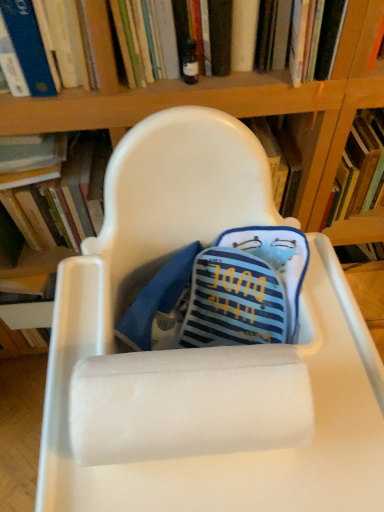
Measure the distance between hardcover book at upper center, the 3th book in the left-to-right sequence, and camera.

The distance of hardcover book at upper center, the 3th book in the left-to-right sequence, from camera is 23.37 inches.

Measure the distance between white fluffy paper towel at center and camera.

They are 15.78 inches apart.

What do you see at coordinates (203, 353) in the screenshot? The height and width of the screenshot is (512, 384). I see `white plastic chair at center` at bounding box center [203, 353].

In order to face hardcover book at left, the first book from the left, should I rotate leftwards or rightwards?

Turn left approximately 18.351 degrees to face it.

What do you see at coordinates (63, 199) in the screenshot?
I see `hardcover book at left, the first book from the left` at bounding box center [63, 199].

This screenshot has width=384, height=512. What are the coordinates of `hardcover book at upper center, the 1th book viewed from the right` in the screenshot? It's located at (245, 80).

Considering the sizes of hardcover book at upper center, the 1th book viewed from the right, and white plastic chair at center in the image, is hardcover book at upper center, the 1th book viewed from the right, bigger or smaller than white plastic chair at center?

hardcover book at upper center, the 1th book viewed from the right, is smaller than white plastic chair at center.

Is hardcover book at upper center, the 3th book in the left-to-right sequence, positioned before white plastic chair at center?

No, hardcover book at upper center, the 3th book in the left-to-right sequence, is behind white plastic chair at center.

Can white plastic chair at center be found inside hardcover book at upper center, the 1th book viewed from the right?

No, white plastic chair at center is not surrounded by hardcover book at upper center, the 1th book viewed from the right.

From a real-world perspective, starting from the blue hardcover book at upper left, arranged as the 2th book when viewed from the left, which book is the 2nd one below it? Please provide its 2D coordinates.

[(63, 199)]

Between hardcover book at left, which is the third book from right to left, and blue hardcover book at upper left, the 2th book viewed from the right, which one has larger size?

hardcover book at left, which is the third book from right to left.

Is white fluffy paper towel at center aimed at hardcover book at upper center, the 3th book in the left-to-right sequence?

No.

From the image's perspective, which is above, white fluffy paper towel at center or hardcover book at upper center, the 1th book viewed from the right?

hardcover book at upper center, the 1th book viewed from the right.

Where is `the 1st book directly above the white fluffy paper towel at center (from a real-world perspective)`? The width and height of the screenshot is (384, 512). the 1st book directly above the white fluffy paper towel at center (from a real-world perspective) is located at coordinates (245, 80).

Considering the positions of objects white plastic chair at center and hardcover book at left, the first book from the left, in the image provided, who is more to the right, white plastic chair at center or hardcover book at left, the first book from the left,?

From the viewer's perspective, white plastic chair at center appears more on the right side.

Is white plastic chair at center aimed at hardcover book at left, which is the third book from right to left?

No, white plastic chair at center does not turn towards hardcover book at left, which is the third book from right to left.

From a real-world perspective, which book is the 1st one above the white plastic chair at center? Please provide its 2D coordinates.

[(63, 199)]

Consider the image. Measure the distance between white fluffy paper towel at center and white plastic chair at center.

The distance of white fluffy paper towel at center from white plastic chair at center is 4.88 inches.

Considering the relative positions of white fluffy paper towel at center and white plastic chair at center in the image provided, is white fluffy paper towel at center to the left or to the right of white plastic chair at center?

In the image, white fluffy paper towel at center appears on the left side of white plastic chair at center.

Does white fluffy paper towel at center have a smaller size compared to white plastic chair at center?

Yes, white fluffy paper towel at center is smaller than white plastic chair at center.

Can white plastic chair at center be found inside white fluffy paper towel at center?

No, white plastic chair at center is not surrounded by white fluffy paper towel at center.

From the image's perspective, is hardcover book at left, which is the third book from right to left, beneath white plastic chair at center?

Actually, hardcover book at left, which is the third book from right to left, appears above white plastic chair at center in the image.

Considering the sizes of objects hardcover book at left, the first book from the left, and white plastic chair at center in the image provided, who is wider, hardcover book at left, the first book from the left, or white plastic chair at center?

white plastic chair at center is wider.

Consider the image. Is hardcover book at left, which is the third book from right to left, situated inside white plastic chair at center or outside?

The correct answer is: outside.

Considering their positions, is hardcover book at left, the first book from the left, located in front of or behind white plastic chair at center?

In the image, hardcover book at left, the first book from the left, appears behind white plastic chair at center.

Considering the positions of objects white plastic chair at center and hardcover book at upper center, the 1th book viewed from the right, in the image provided, who is behind, white plastic chair at center or hardcover book at upper center, the 1th book viewed from the right,?

hardcover book at upper center, the 1th book viewed from the right.

From the image's perspective, between white plastic chair at center and hardcover book at upper center, the 3th book in the left-to-right sequence, which one is located above?

hardcover book at upper center, the 3th book in the left-to-right sequence.

Are white plastic chair at center and hardcover book at upper center, the 3th book in the left-to-right sequence, beside each other?

No, white plastic chair at center is not with hardcover book at upper center, the 3th book in the left-to-right sequence.

Which is further, [379,452] or [277,75]?

The point [277,75] is farther from the camera.

Where is `the 2nd book positioned above the white plastic chair at center (from a real-world perspective)`? This screenshot has width=384, height=512. the 2nd book positioned above the white plastic chair at center (from a real-world perspective) is located at coordinates (245, 80).

Where is `the 1st book above the hardcover book at left, which is the third book from right to left (from the image's perspective)`? This screenshot has height=512, width=384. the 1st book above the hardcover book at left, which is the third book from right to left (from the image's perspective) is located at coordinates (27, 49).

Looking at the image, which one is located further to hardcover book at upper center, the 1th book viewed from the right, blue hardcover book at upper left, arranged as the 2th book when viewed from the left, or white plastic chair at center?

The object further to hardcover book at upper center, the 1th book viewed from the right, is white plastic chair at center.

Considering their positions, is white plastic chair at center positioned closer to hardcover book at upper center, the 3th book in the left-to-right sequence, than blue hardcover book at upper left, arranged as the 2th book when viewed from the left?

The object closer to hardcover book at upper center, the 3th book in the left-to-right sequence, is blue hardcover book at upper left, arranged as the 2th book when viewed from the left.

Looking at the image, which one is located further to hardcover book at upper center, the 3th book in the left-to-right sequence, blue hardcover book at upper left, the 2th book viewed from the right, or hardcover book at left, which is the third book from right to left?

The object further to hardcover book at upper center, the 3th book in the left-to-right sequence, is hardcover book at left, which is the third book from right to left.

Estimate the real-world distances between objects in this image. Which object is closer to blue hardcover book at upper left, arranged as the 2th book when viewed from the left, white plastic chair at center or hardcover book at upper center, the 3th book in the left-to-right sequence?

hardcover book at upper center, the 3th book in the left-to-right sequence, is positioned closer to the anchor blue hardcover book at upper left, arranged as the 2th book when viewed from the left.

Which object lies nearer to the anchor point hardcover book at left, the first book from the left, white fluffy paper towel at center or hardcover book at upper center, the 1th book viewed from the right?

Based on the image, hardcover book at upper center, the 1th book viewed from the right, appears to be nearer to hardcover book at left, the first book from the left.

Considering their positions, is hardcover book at upper center, the 3th book in the left-to-right sequence, positioned closer to blue hardcover book at upper left, arranged as the 2th book when viewed from the left, than hardcover book at left, the first book from the left?

hardcover book at upper center, the 3th book in the left-to-right sequence, is closer to blue hardcover book at upper left, arranged as the 2th book when viewed from the left.

Based on the photo, looking at the image, which one is located further to white plastic chair at center, blue hardcover book at upper left, arranged as the 2th book when viewed from the left, or hardcover book at left, the first book from the left?

blue hardcover book at upper left, arranged as the 2th book when viewed from the left, is positioned further to the anchor white plastic chair at center.

Which object lies nearer to the anchor point hardcover book at left, the first book from the left, white plastic chair at center or blue hardcover book at upper left, arranged as the 2th book when viewed from the left?

blue hardcover book at upper left, arranged as the 2th book when viewed from the left, is closer to hardcover book at left, the first book from the left.

The image size is (384, 512). I want to click on paper towel between blue hardcover book at upper left, the 2th book viewed from the right, and white plastic chair at center, in the vertical direction, so click(188, 403).

The image size is (384, 512). In order to click on paper towel between white plastic chair at center and hardcover book at left, the first book from the left, in the front-back direction in this screenshot , I will do `click(188, 403)`.

You are a GUI agent. You are given a task and a screenshot of the screen. Output one action in this format:
    pyautogui.click(x=<x>, y=<y>)
    Task: Click on the book between hardcover book at left, the first book from the left, and hardcover book at upper center, the 3th book in the left-to-right sequence, in the horizontal direction
    This screenshot has height=512, width=384.
    Given the screenshot: What is the action you would take?
    pyautogui.click(x=27, y=49)

Locate an element on the screen. book between blue hardcover book at upper left, the 2th book viewed from the right, and white plastic chair at center from top to bottom is located at coordinates (63, 199).